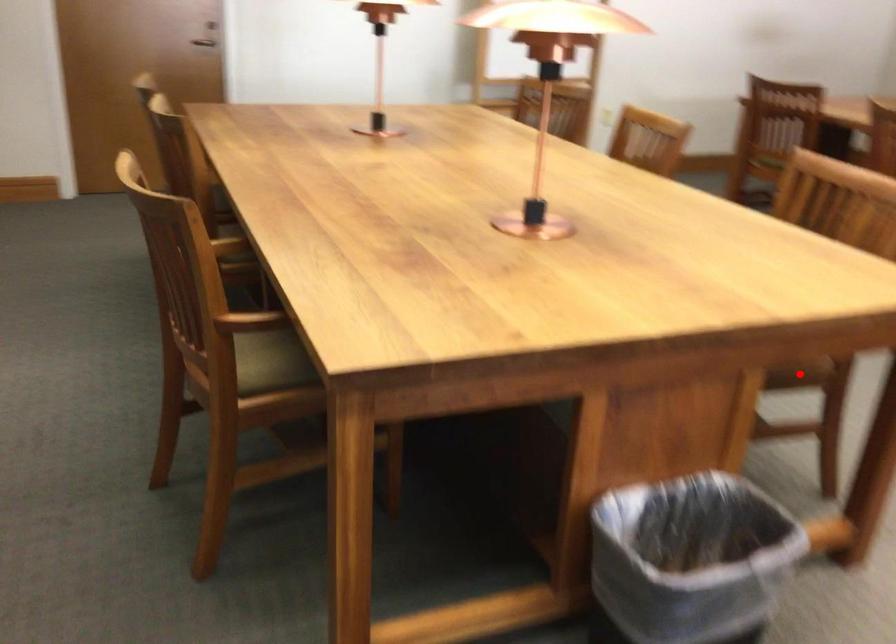
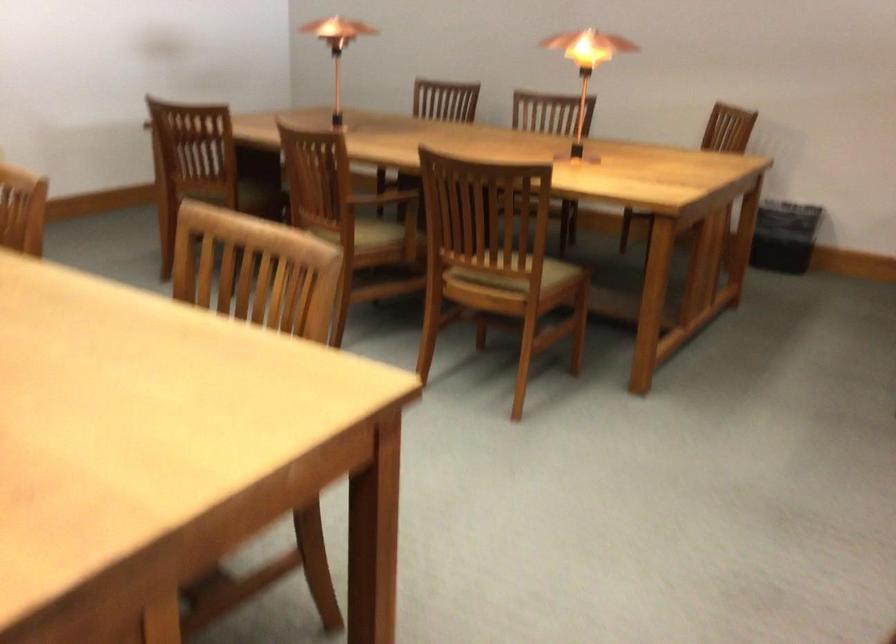
Question: I am providing you with two images of the same scene from different viewpoints. A red point is marked on the first image. Can you still see the location of the red point in image 2?

Choices:
 (A) Yes
 (B) No

Answer: (B)